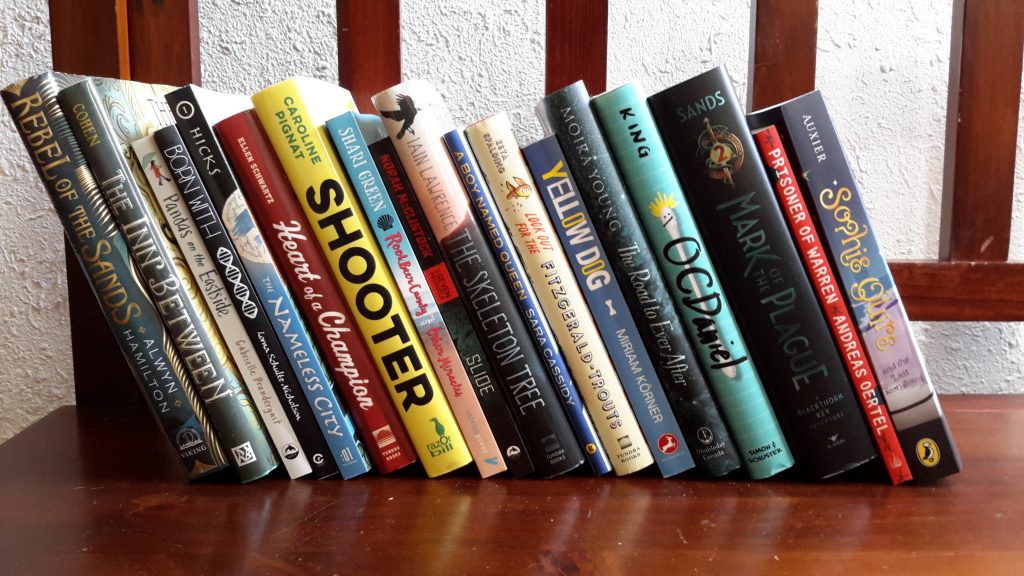
You are a GUI agent. You are given a task and a screenshot of the screen. Output one action in this format:
    pyautogui.click(x=<x>, y=<y>)
    Task: Click on the yellow book
    This screenshot has height=576, width=1024.
    Given the screenshot: What is the action you would take?
    pyautogui.click(x=304, y=170)